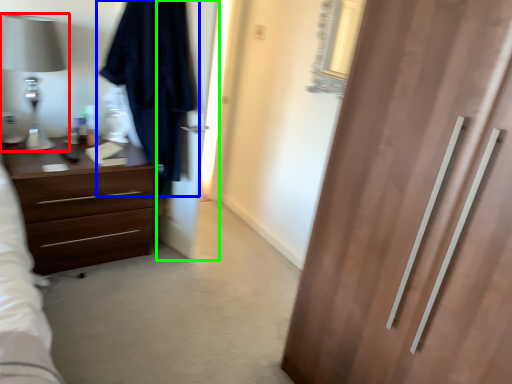
Question: Which object is the closest to the table lamp (highlighted by a red box)? Choose among these: robe (highlighted by a blue box) or screen door (highlighted by a green box).

Choices:
 (A) robe
 (B) screen door

Answer: (A)